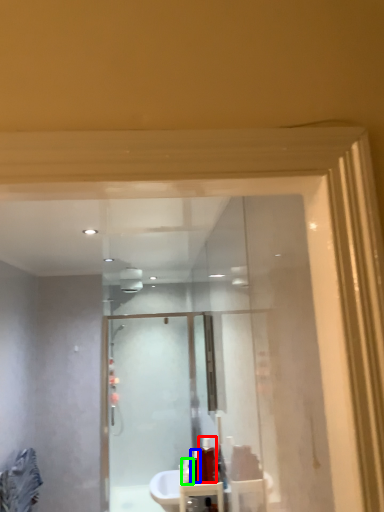
Question: Estimate the real-world distances between objects in this image. Which object is closer to toiletry (highlighted by a red box), toiletry (highlighted by a blue box) or toiletry (highlighted by a green box)?

Choices:
 (A) toiletry
 (B) toiletry

Answer: (A)